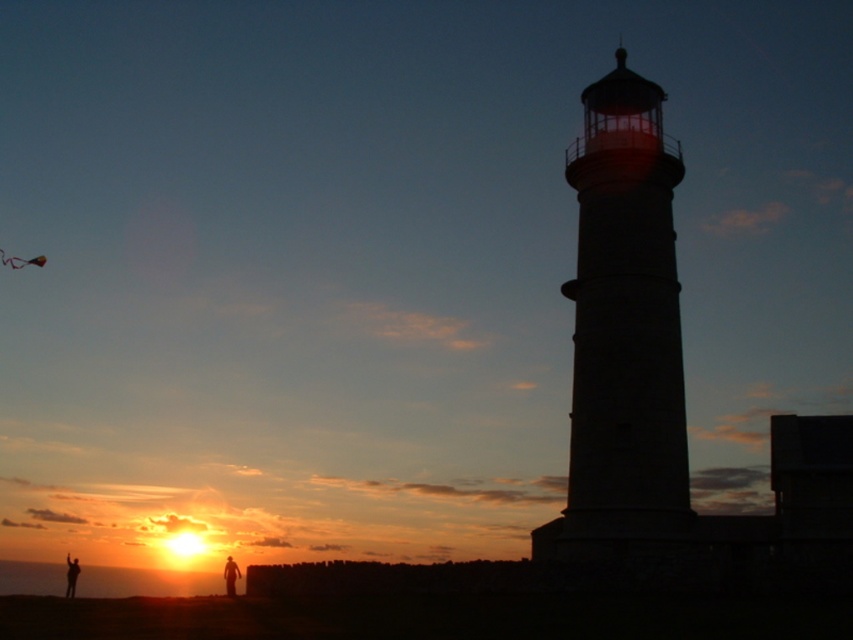
Question: Among these points, which one is farthest from the camera?

Choices:
 (A) (32, 260)
 (B) (228, 584)

Answer: (A)

Question: In this image, where is silhouette figure at lower center located relative to silhouette figure at lower left?

Choices:
 (A) left
 (B) right

Answer: (B)

Question: Which point is closer to the camera?

Choices:
 (A) (233, 564)
 (B) (592, 252)

Answer: (B)

Question: From the image, what is the correct spatial relationship of multicolored fabric kite at upper left in relation to silhouette figure at lower center?

Choices:
 (A) right
 (B) left

Answer: (B)

Question: Estimate the real-world distances between objects in this image. Which object is farther from the silhouette figure at lower center?

Choices:
 (A) silhouette figure at lower left
 (B) white stone tower at center

Answer: (B)

Question: Can you confirm if silhouette figure at lower center is bigger than silhouette figure at lower left?

Choices:
 (A) yes
 (B) no

Answer: (A)